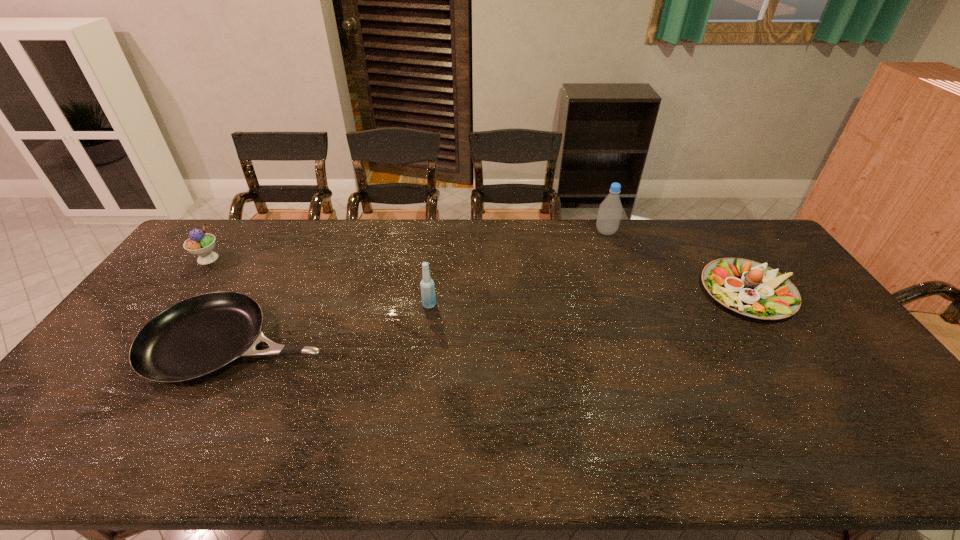
Identify the location of vacant space at the near edge. The height and width of the screenshot is (540, 960). (517, 441).

This screenshot has width=960, height=540. In order to click on free location at the left edge of the desktop in this screenshot , I will do `click(129, 381)`.

At what (x,y) coordinates should I click in order to perform the action: click on vacant space at the right edge. Please return your answer as a coordinate pair (x, y). This screenshot has height=540, width=960. Looking at the image, I should click on (831, 381).

Identify the location of vacant space at the far left corner. The width and height of the screenshot is (960, 540). (254, 219).

Locate an element on the screen. This screenshot has width=960, height=540. free space at the far right corner of the desktop is located at coordinates (741, 224).

Where is `free spot between the salad plate and the pan`? Image resolution: width=960 pixels, height=540 pixels. free spot between the salad plate and the pan is located at coordinates (495, 318).

What are the coordinates of `free space between the shortest object and the salad plate` in the screenshot? It's located at (495, 318).

Identify the location of empty space between the tallest object and the icecream. (407, 245).

Where is `vacant region between the salad plate and the farther bottle`? vacant region between the salad plate and the farther bottle is located at coordinates pos(678,262).

At what (x,y) coordinates should I click in order to perform the action: click on blank region between the farther bottle and the nearer bottle. Please return your answer as a coordinate pair (x, y). The height and width of the screenshot is (540, 960). Looking at the image, I should click on (517, 268).